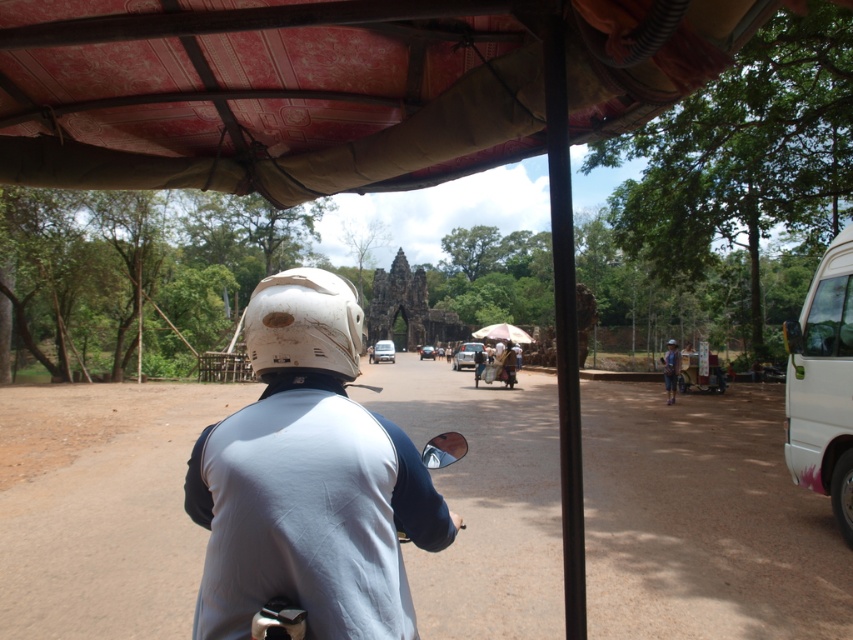
Question: Estimate the real-world distances between objects in this image. Which object is closer to the blue denim jacket at center?

Choices:
 (A) red fabric canopy at upper center
 (B) white matte van at right
 (C) white matte helmet at center

Answer: (B)

Question: Considering the real-world distances, which object is farthest from the silver metallic van at center?

Choices:
 (A) red fabric canopy at upper center
 (B) white matte van at right
 (C) blue denim jacket at center

Answer: (A)

Question: Which of the following is the farthest from the observer?

Choices:
 (A) (379, 356)
 (B) (668, 362)

Answer: (A)

Question: Does brown dirt track at center have a larger size compared to silver metallic van at center?

Choices:
 (A) no
 (B) yes

Answer: (B)

Question: Observing the image, what is the correct spatial positioning of white matte helmet at center in reference to silver metallic van at center?

Choices:
 (A) left
 (B) right

Answer: (B)

Question: Can you confirm if white matte helmet at center is wider than blue denim jacket at center?

Choices:
 (A) no
 (B) yes

Answer: (A)